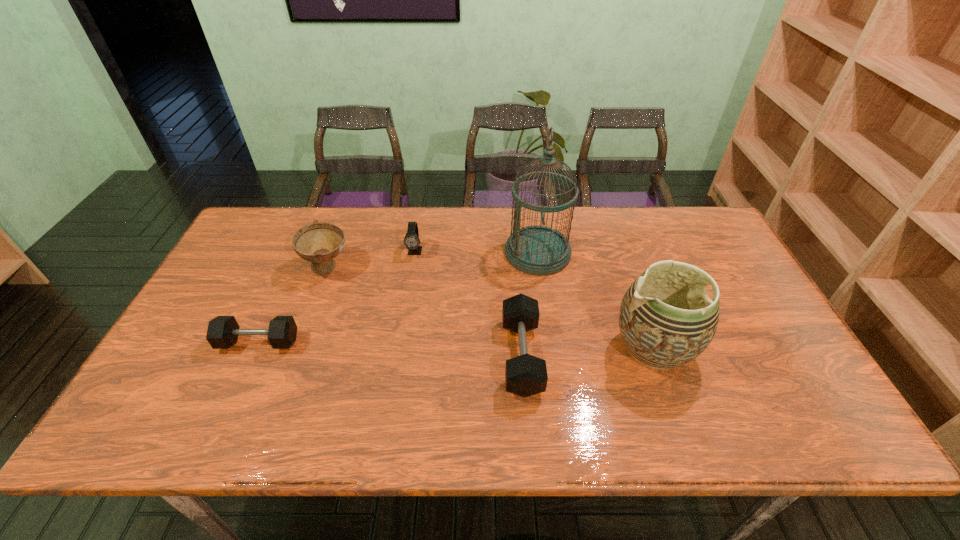
Given the evenly spaced dumbbells in the image, where should an extra dumbbell be added on the right to preserve the spacing? Please point to a vacant space. Please provide its 2D coordinates. Your answer should be formatted as a tuple, i.e. [(x, y)], where the tuple contains the x and y coordinates of a point satisfying the conditions above.

[(800, 370)]